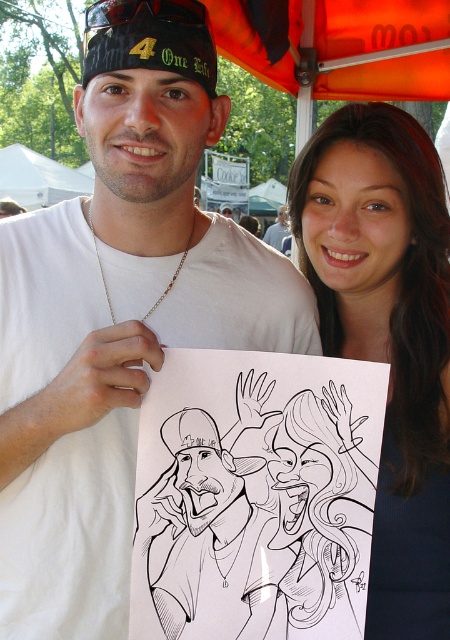
Question: Does black line drawing at center have a larger size compared to orange fabric canopy at upper center?

Choices:
 (A) no
 (B) yes

Answer: (A)

Question: Which of these objects is positioned farthest from the black line drawing at center?

Choices:
 (A) smooth dark hair at center
 (B) orange fabric canopy at upper center

Answer: (B)

Question: Which object is closer to the camera taking this photo?

Choices:
 (A) smooth dark hair at center
 (B) black line drawing at center
 (C) orange fabric canopy at upper center

Answer: (B)

Question: Can you confirm if black line drawing at center is smaller than orange fabric canopy at upper center?

Choices:
 (A) yes
 (B) no

Answer: (A)

Question: Is white matte t-shirt at center positioned at the back of orange fabric canopy at upper center?

Choices:
 (A) no
 (B) yes

Answer: (A)

Question: Among these points, which one is nearest to the camera?

Choices:
 (A) (176, 586)
 (B) (413, 435)
 (C) (401, 26)
 (D) (31, 410)

Answer: (A)